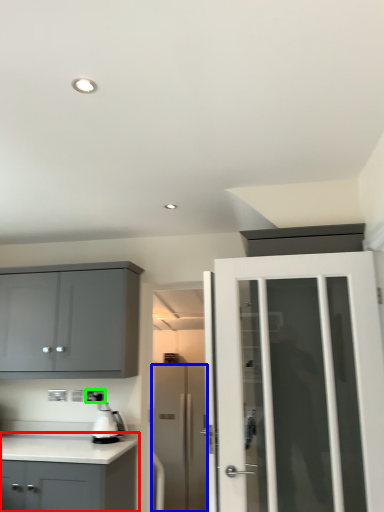
Question: Estimate the real-world distances between objects in this image. Which object is farther from cabinetry (highlighted by a red box), door (highlighted by a blue box) or electric outlet (highlighted by a green box)?

Choices:
 (A) door
 (B) electric outlet

Answer: (A)